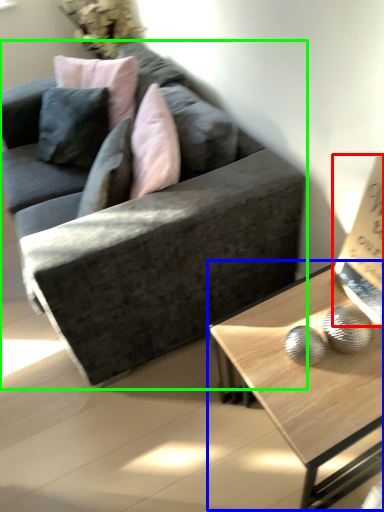
Question: Based on their relative distances, which object is nearer to paperback book (highlighted by a red box)? Choose from coffee table (highlighted by a blue box) and studio couch (highlighted by a green box).

Choices:
 (A) coffee table
 (B) studio couch

Answer: (A)